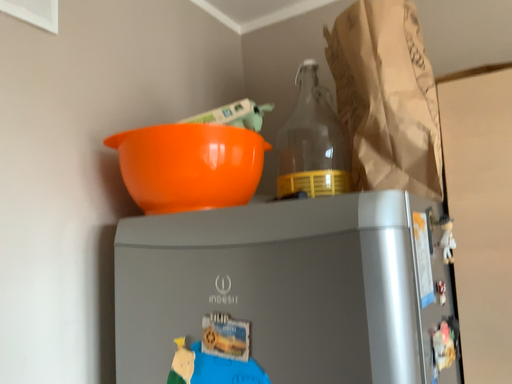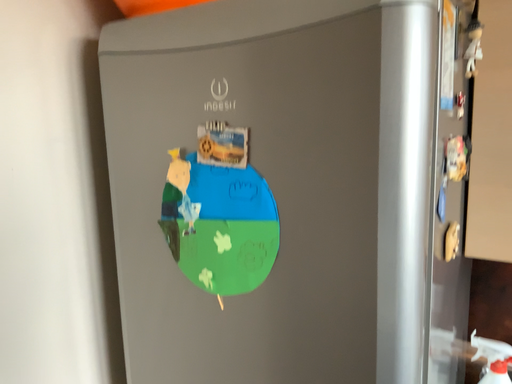
Question: Which way did the camera rotate in the video?

Choices:
 (A) rotated downward
 (B) rotated upward

Answer: (A)